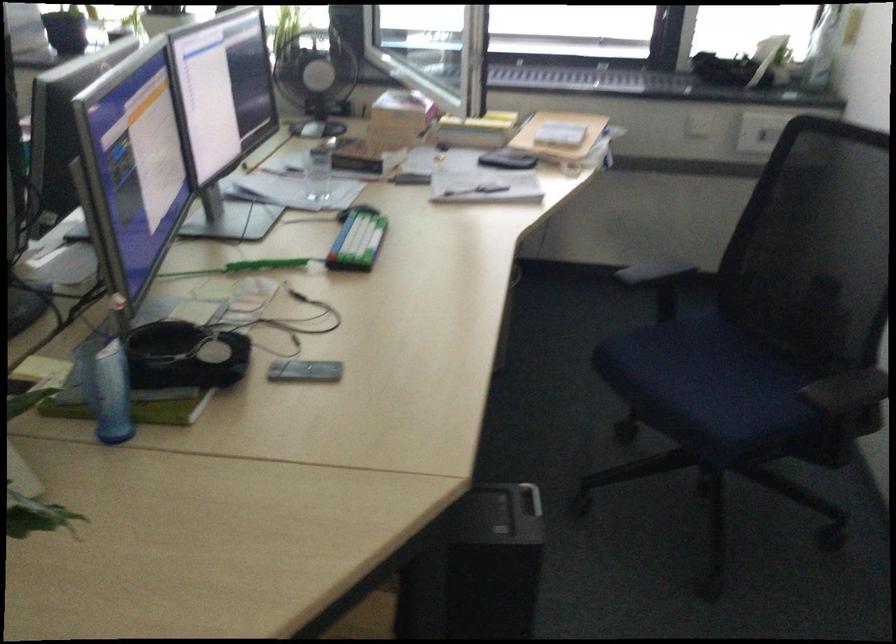
The width and height of the screenshot is (896, 644). Find the location of `silver remote control`. silver remote control is located at coordinates (305, 371).